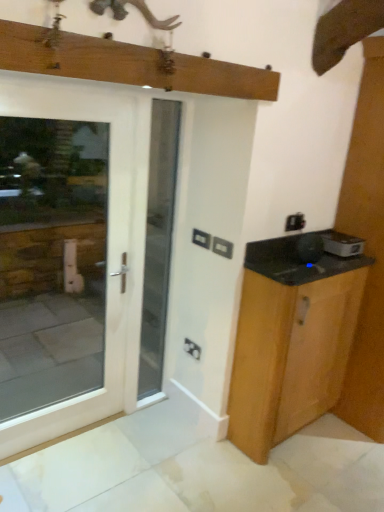
Question: Which direction should I rotate to look at black plastic electric outlet at center, the 2th electric outlet positioned from the bottom?

Choices:
 (A) left
 (B) right

Answer: (B)

Question: Which direction should I rotate to look at matte black electric outlet at center, the 1th electric outlet viewed from the back, — up or down?

Choices:
 (A) down
 (B) up

Answer: (A)

Question: Does white plastic electric outlet at center, the first electric outlet when ordered from top to bottom, have a greater width compared to white glossy door at center?

Choices:
 (A) no
 (B) yes

Answer: (A)

Question: From a real-world perspective, is white plastic electric outlet at center, which is counted as the second electric outlet, starting from the front, located beneath white glossy door at center?

Choices:
 (A) yes
 (B) no

Answer: (B)

Question: Is white plastic electric outlet at center, which is counted as the second electric outlet, starting from the front, aimed at white glossy door at center?

Choices:
 (A) no
 (B) yes

Answer: (A)

Question: From a real-world perspective, does white plastic electric outlet at center, marked as the 2th electric outlet in a back-to-front arrangement, stand above white glossy door at center?

Choices:
 (A) yes
 (B) no

Answer: (A)

Question: From the image's perspective, is white plastic electric outlet at center, the third electric outlet in the bottom-to-top sequence, on top of white glossy door at center?

Choices:
 (A) yes
 (B) no

Answer: (A)

Question: Considering the relative sizes of white plastic electric outlet at center, the first electric outlet when ordered from top to bottom, and white glossy door at center in the image provided, is white plastic electric outlet at center, the first electric outlet when ordered from top to bottom, taller than white glossy door at center?

Choices:
 (A) no
 (B) yes

Answer: (A)

Question: Is white glossy door at center closer to camera compared to wooden cabinet at right?

Choices:
 (A) yes
 (B) no

Answer: (B)

Question: Is white glossy door at center placed right next to wooden cabinet at right?

Choices:
 (A) no
 (B) yes

Answer: (A)

Question: Considering the relative sizes of white glossy door at center and wooden cabinet at right in the image provided, is white glossy door at center thinner than wooden cabinet at right?

Choices:
 (A) no
 (B) yes

Answer: (B)

Question: Can you confirm if white glossy door at center is shorter than wooden cabinet at right?

Choices:
 (A) yes
 (B) no

Answer: (B)

Question: Would you say white glossy door at center is outside wooden cabinet at right?

Choices:
 (A) yes
 (B) no

Answer: (A)

Question: Can you confirm if white glossy door at center is wider than wooden cabinet at right?

Choices:
 (A) yes
 (B) no

Answer: (B)

Question: Does matte black electric outlet at center, the 1th electric outlet viewed from the back, appear on the right side of white glossy door at center?

Choices:
 (A) yes
 (B) no

Answer: (A)